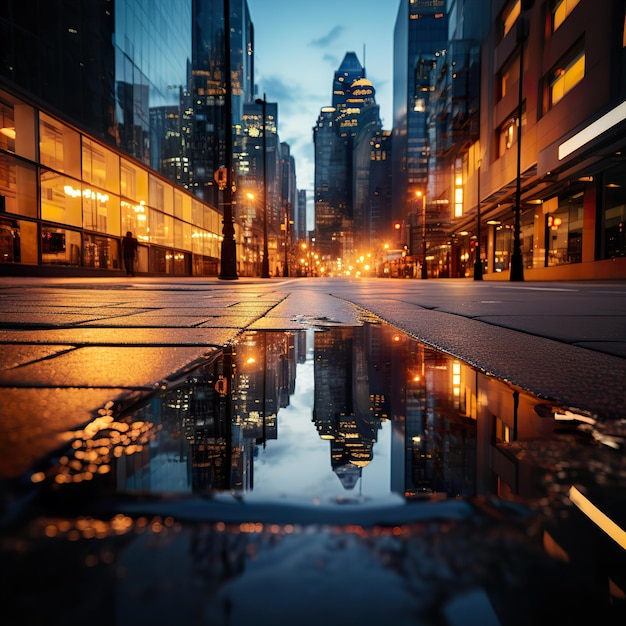
Where is `visible lights`? visible lights is located at coordinates (64, 193), (84, 193), (94, 198), (195, 231), (371, 259), (364, 272).